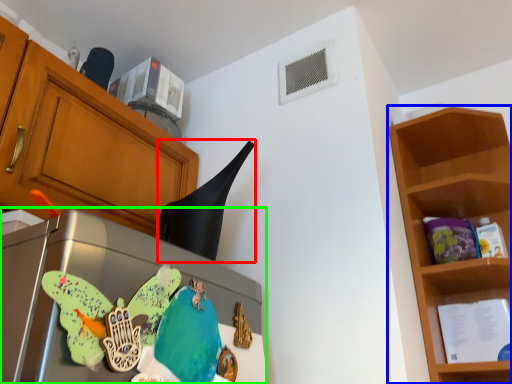
Question: Which is nearer to the exhaust hood (highlighted by a red box)? shelf (highlighted by a blue box) or appliance (highlighted by a green box).

Choices:
 (A) shelf
 (B) appliance

Answer: (B)